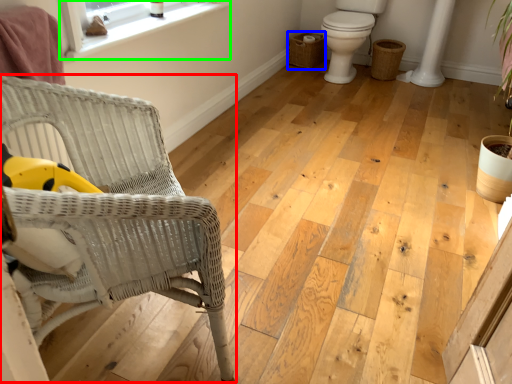
Question: Estimate the real-world distances between objects in this image. Which object is farther from chair (highlighted by a red box), basket (highlighted by a blue box) or window (highlighted by a green box)?

Choices:
 (A) basket
 (B) window

Answer: (A)